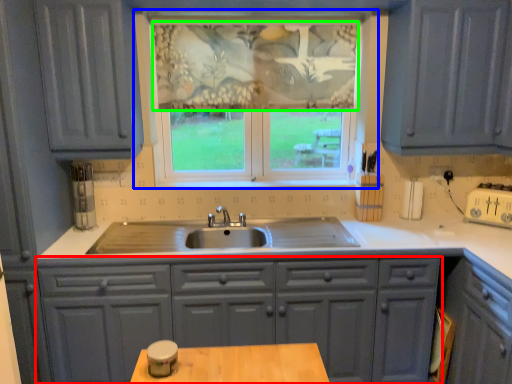
Question: Which is farther away from cabinetry (highlighted by a red box)? window (highlighted by a blue box) or curtain (highlighted by a green box)?

Choices:
 (A) window
 (B) curtain

Answer: (B)